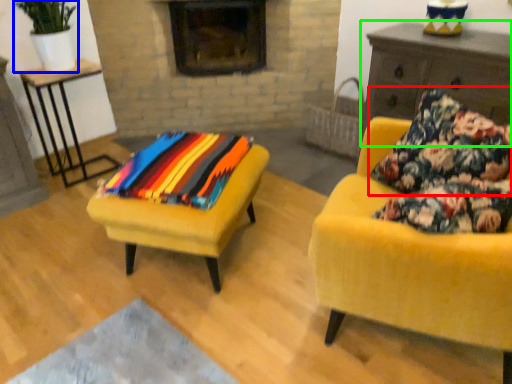
Question: Which object is the farthest from pillow (highlighted by a red box)? Choose among these: houseplant (highlighted by a blue box) or dresser (highlighted by a green box).

Choices:
 (A) houseplant
 (B) dresser

Answer: (A)